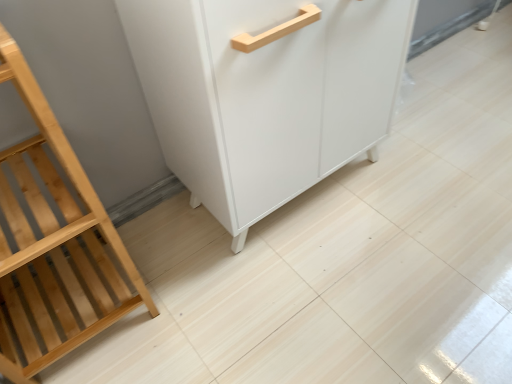
In order to click on white matte cabinet at center in this screenshot , I will do `click(265, 94)`.

The image size is (512, 384). What do you see at coordinates (265, 94) in the screenshot?
I see `white matte cabinet at center` at bounding box center [265, 94].

Measure the distance between point (73, 206) and camera.

The distance of point (73, 206) from camera is 84.50 centimeters.

Describe the element at coordinates (54, 242) in the screenshot. I see `natural wood shelf at left` at that location.

Find the location of `natural wood shelf at left`. natural wood shelf at left is located at coordinates (54, 242).

Find the location of a particular element. white matte cabinet at center is located at coordinates (265, 94).

Does white matte cabinet at center appear on the left side of natural wood shelf at left?

No, white matte cabinet at center is not to the left of natural wood shelf at left.

Which object is more forward, white matte cabinet at center or natural wood shelf at left?

natural wood shelf at left is closer to the camera.

Is point (200, 9) behind point (21, 380)?

No, it is not.

From the image's perspective, which is above, white matte cabinet at center or natural wood shelf at left?

white matte cabinet at center, from the image's perspective.

From a real-world perspective, is white matte cabinet at center physically located above or below natural wood shelf at left?

white matte cabinet at center is below natural wood shelf at left.

In terms of width, does white matte cabinet at center look wider or thinner when compared to natural wood shelf at left?

Considering their sizes, white matte cabinet at center looks broader than natural wood shelf at left.

Considering the sizes of objects white matte cabinet at center and natural wood shelf at left in the image provided, who is shorter, white matte cabinet at center or natural wood shelf at left?

white matte cabinet at center.

Considering the sizes of objects white matte cabinet at center and natural wood shelf at left in the image provided, who is bigger, white matte cabinet at center or natural wood shelf at left?

white matte cabinet at center is bigger.

Is natural wood shelf at left surrounded by white matte cabinet at center?

No, natural wood shelf at left is not a part of white matte cabinet at center.

Is white matte cabinet at center far away from natural wood shelf at left?

white matte cabinet at center is actually quite close to natural wood shelf at left.

Does white matte cabinet at center turn towards natural wood shelf at left?

No, white matte cabinet at center is not turned towards natural wood shelf at left.

What's the angular difference between white matte cabinet at center and natural wood shelf at left's facing directions?

white matte cabinet at center and natural wood shelf at left are facing 0.768 degrees away from each other.

Where is `cupboard above the natural wood shelf at left (from the image's perspective)`? cupboard above the natural wood shelf at left (from the image's perspective) is located at coordinates (265, 94).

Would you say natural wood shelf at left is to the left or to the right of white matte cabinet at center in the picture?

In the image, natural wood shelf at left appears on the left side of white matte cabinet at center.

Is natural wood shelf at left in front of or behind white matte cabinet at center in the image?

Clearly, natural wood shelf at left is in front of white matte cabinet at center.

Between point (49, 126) and point (148, 52), which one is positioned behind?

Point (148, 52)

From the image's perspective, does natural wood shelf at left appear higher than white matte cabinet at center?

No, from the image's perspective, natural wood shelf at left is not on top of white matte cabinet at center.

Consider the image. From a real-world perspective, which is physically above, natural wood shelf at left or white matte cabinet at center?

From a 3D spatial view, natural wood shelf at left is above.

Does natural wood shelf at left have a greater width compared to white matte cabinet at center?

No.

Does natural wood shelf at left have a lesser height compared to white matte cabinet at center?

Incorrect, the height of natural wood shelf at left does not fall short of that of white matte cabinet at center.

Considering the sizes of natural wood shelf at left and white matte cabinet at center in the image, is natural wood shelf at left bigger or smaller than white matte cabinet at center?

In the image, natural wood shelf at left appears to be smaller than white matte cabinet at center.

Would you say natural wood shelf at left is outside white matte cabinet at center?

natural wood shelf at left lies outside white matte cabinet at center's area.

Looking at this image, is natural wood shelf at left far from white matte cabinet at center?

No.

Could you tell me if natural wood shelf at left is turned towards white matte cabinet at center?

No, natural wood shelf at left is not turned towards white matte cabinet at center.

Measure the distance from natural wood shelf at left to white matte cabinet at center.

natural wood shelf at left and white matte cabinet at center are 42.33 centimeters apart.

Where is `furniture below the white matte cabinet at center (from the image's perspective)`? furniture below the white matte cabinet at center (from the image's perspective) is located at coordinates 54,242.

Where is `furniture positioned vertically above the white matte cabinet at center (from a real-world perspective)`? furniture positioned vertically above the white matte cabinet at center (from a real-world perspective) is located at coordinates pyautogui.click(x=54, y=242).

Locate an element on the screen. cupboard beneath the natural wood shelf at left (from a real-world perspective) is located at coordinates (265, 94).